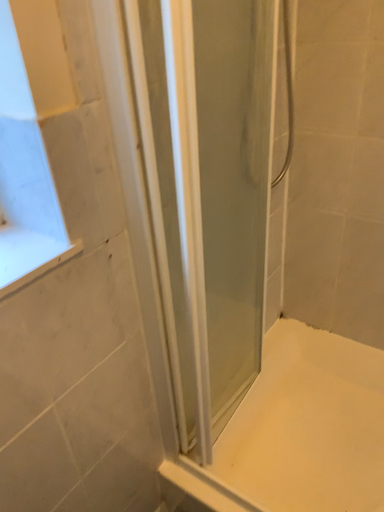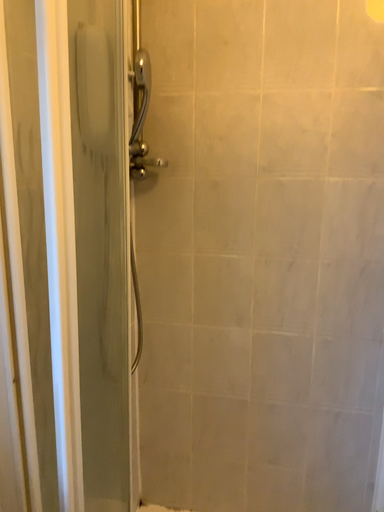
Question: Which way did the camera rotate in the video?

Choices:
 (A) rotated right
 (B) rotated left

Answer: (A)